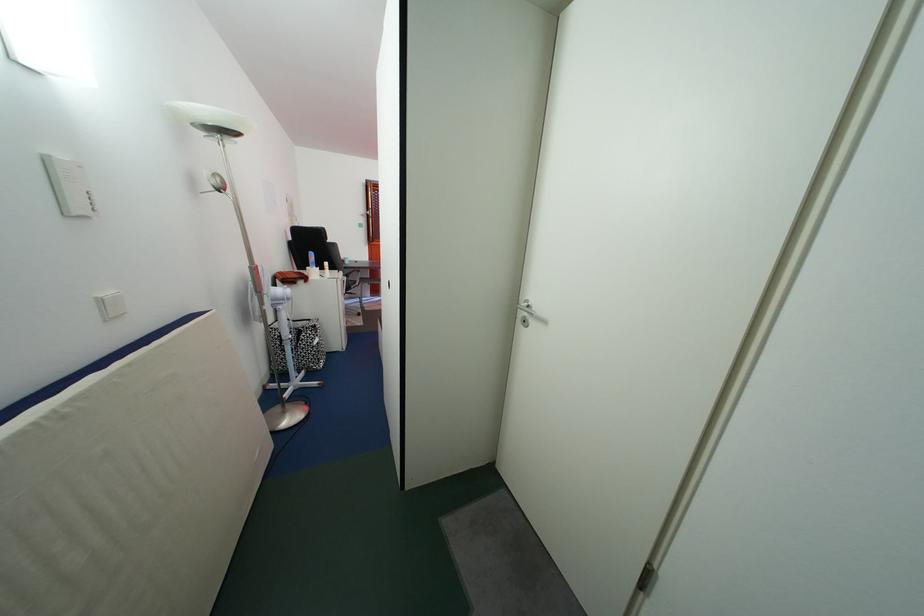
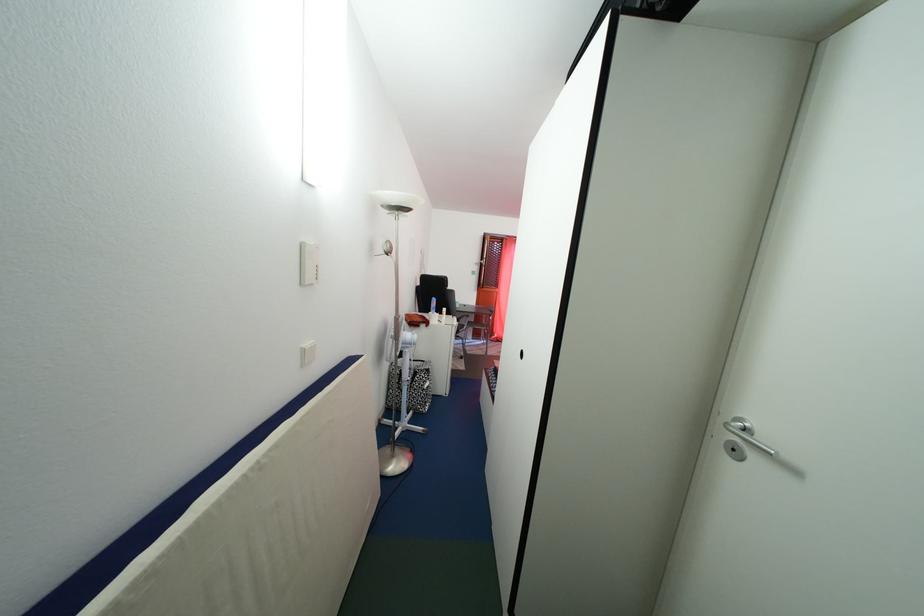
Locate, in the second image, the point that corresponds to pixel 201 187 in the first image.

(381, 253)